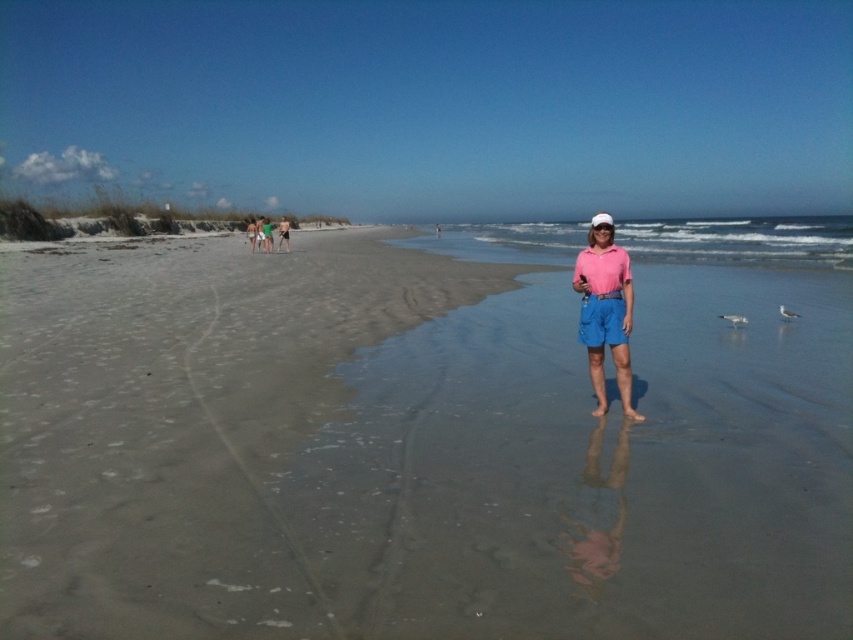
Question: Which point is closer to the camera?

Choices:
 (A) tan skin at center
 (B) sandy beach at center
 (C) pink cotton shorts at center

Answer: (B)

Question: Can you confirm if sandy beach at center is thinner than tan skin at center?

Choices:
 (A) yes
 (B) no

Answer: (B)

Question: Which object is the closest to the green fabric shorts at center?

Choices:
 (A) tan skin at center
 (B) pink cotton shorts at center
 (C) blue water at center

Answer: (A)

Question: Which point is farther to the camera?

Choices:
 (A) (279, 237)
 (B) (837, 256)

Answer: (A)

Question: Is pink cotton shorts at center below green fabric shorts at center?

Choices:
 (A) no
 (B) yes

Answer: (B)

Question: From the image, what is the correct spatial relationship of pink cotton shorts at center in relation to tan skin at center?

Choices:
 (A) above
 (B) below

Answer: (B)